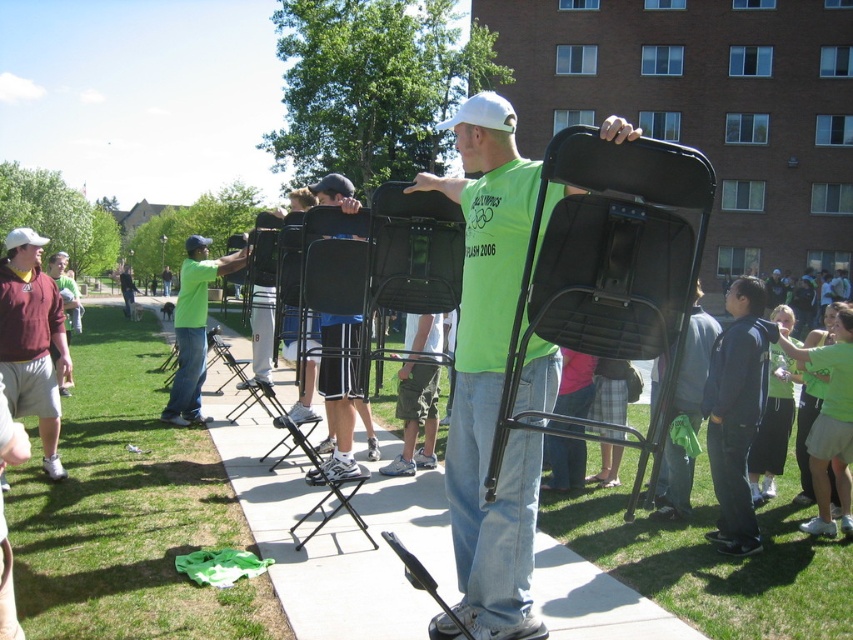
Question: Where is black plastic chair at center located in relation to green fabric shirt at center in the image?

Choices:
 (A) above
 (B) below

Answer: (B)

Question: Which object is closer to the camera taking this photo?

Choices:
 (A) black metal folding chair at center
 (B) neon green t-shirt at center
 (C) dark blue jacket at lower right

Answer: (A)

Question: Is black plastic chair at center positioned at the back of black metal folding chair at center?

Choices:
 (A) yes
 (B) no

Answer: (A)

Question: Can you confirm if black plastic chair at center is positioned to the right of neon green t-shirt at center?

Choices:
 (A) yes
 (B) no

Answer: (A)

Question: Which object is closer to the camera taking this photo?

Choices:
 (A) matte green t-shirt at center
 (B) matte black shorts at center

Answer: (A)

Question: Which of these objects is positioned farthest from the matte green t-shirt at center?

Choices:
 (A) matte black shorts at center
 (B) green fabric shirt at center
 (C) black metal folding chair at center

Answer: (A)